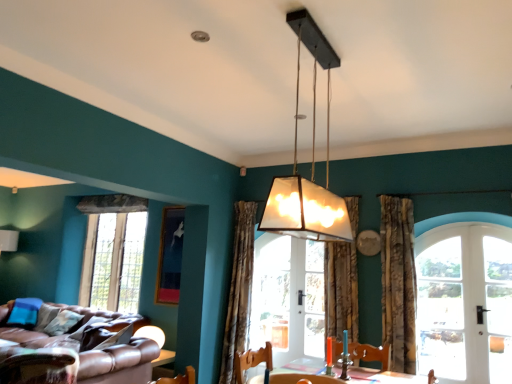
Question: Should I look upward or downward to see clear glass door at right?

Choices:
 (A) down
 (B) up

Answer: (A)

Question: Should I look upward or downward to see textured beige curtain at center, the 2th curtain from the left?

Choices:
 (A) down
 (B) up

Answer: (A)

Question: Is floral fabric curtain at right, which is counted as the 1th curtain, starting from the right, oriented towards brown leather couch at lower left?

Choices:
 (A) yes
 (B) no

Answer: (B)

Question: Does floral fabric curtain at right, which is counted as the 1th curtain, starting from the right, have a greater width compared to brown leather couch at lower left?

Choices:
 (A) yes
 (B) no

Answer: (B)

Question: Does floral fabric curtain at right, which is counted as the 1th curtain, starting from the right, have a greater height compared to brown leather couch at lower left?

Choices:
 (A) no
 (B) yes

Answer: (B)

Question: Is floral fabric curtain at right, which is counted as the 1th curtain, starting from the right, to the right of brown leather couch at lower left from the viewer's perspective?

Choices:
 (A) yes
 (B) no

Answer: (A)

Question: Is floral fabric curtain at right, which is counted as the 1th curtain, starting from the right, closer to camera compared to brown leather couch at lower left?

Choices:
 (A) no
 (B) yes

Answer: (B)

Question: Is floral fabric curtain at right, which is counted as the 1th curtain, starting from the right, positioned beyond the bounds of brown leather couch at lower left?

Choices:
 (A) no
 (B) yes

Answer: (B)

Question: Considering the relative sizes of wooden swivel chair at lower center, the first swivel chair in the right-to-left sequence, and patterned fabric curtain at center, acting as the 3th curtain starting from the right, in the image provided, is wooden swivel chair at lower center, the first swivel chair in the right-to-left sequence, thinner than patterned fabric curtain at center, acting as the 3th curtain starting from the right,?

Choices:
 (A) no
 (B) yes

Answer: (A)

Question: Is wooden swivel chair at lower center, which ranks as the second swivel chair in left-to-right order, closer to the viewer compared to patterned fabric curtain at center, placed as the 1th curtain when sorted from left to right?

Choices:
 (A) no
 (B) yes

Answer: (B)

Question: Is wooden swivel chair at lower center, which ranks as the second swivel chair in left-to-right order, next to patterned fabric curtain at center, acting as the 3th curtain starting from the right, and touching it?

Choices:
 (A) yes
 (B) no

Answer: (B)

Question: Is wooden swivel chair at lower center, which ranks as the second swivel chair in left-to-right order, wider than patterned fabric curtain at center, acting as the 3th curtain starting from the right?

Choices:
 (A) no
 (B) yes

Answer: (B)

Question: Considering the relative sizes of wooden swivel chair at lower center, which ranks as the second swivel chair in left-to-right order, and patterned fabric curtain at center, placed as the 1th curtain when sorted from left to right, in the image provided, is wooden swivel chair at lower center, which ranks as the second swivel chair in left-to-right order, smaller than patterned fabric curtain at center, placed as the 1th curtain when sorted from left to right,?

Choices:
 (A) yes
 (B) no

Answer: (A)

Question: From the image's perspective, does wooden swivel chair at lower center, the first swivel chair in the right-to-left sequence, appear lower than patterned fabric curtain at center, placed as the 1th curtain when sorted from left to right?

Choices:
 (A) no
 (B) yes

Answer: (B)

Question: Does wooden swivel chair at lower center, the first swivel chair in the right-to-left sequence, have a smaller size compared to clear glass window at left, which appears as the first window when viewed from the left?

Choices:
 (A) yes
 (B) no

Answer: (A)